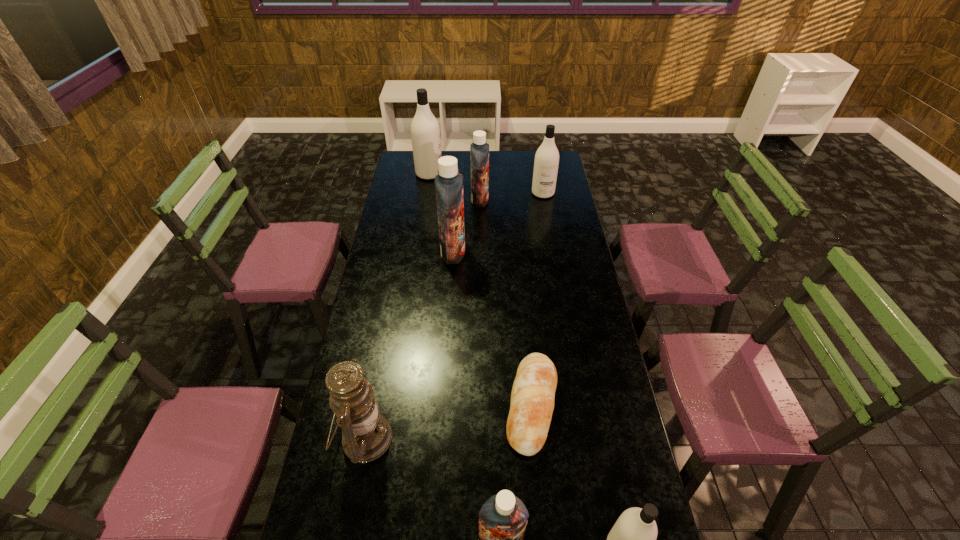
Select which shampoo appears as the second closest to the oil lamp. Please provide its 2D coordinates. Your answer should be formatted as a tuple, i.e. [(x, y)], where the tuple contains the x and y coordinates of a point satisfying the conditions above.

[(632, 539)]

The image size is (960, 540). Find the location of `the second closest white shampoo to the second nearest white shampoo`. the second closest white shampoo to the second nearest white shampoo is located at coordinates (632, 539).

Find the location of a particular element. the closest white shampoo to the nearest blue shampoo is located at coordinates (632, 539).

Identify which blue shampoo is the nearest to the farthest object. Please provide its 2D coordinates. Your answer should be formatted as a tuple, i.e. [(x, y)], where the tuple contains the x and y coordinates of a point satisfying the conditions above.

[(479, 150)]

I want to click on the second closest blue shampoo relative to the smallest blue shampoo, so point(479,150).

Where is `vacant space that satisfies the following two spatial constraints: 1. on the front label of the shortest object; 2. on the left side of the farthest blue shampoo`? vacant space that satisfies the following two spatial constraints: 1. on the front label of the shortest object; 2. on the left side of the farthest blue shampoo is located at coordinates pos(480,406).

The image size is (960, 540). In order to click on free point that satisfies the following two spatial constraints: 1. on the front-facing side of the second farthest white shampoo; 2. on the front label of the fifth nearest object in this screenshot , I will do `click(553, 252)`.

You are a GUI agent. You are given a task and a screenshot of the screen. Output one action in this format:
    pyautogui.click(x=<x>, y=<y>)
    Task: Click on the vacant space that satisfies the following two spatial constraints: 1. on the front label of the farthest blue shampoo; 2. on the front side of the oil lamp
    
    Given the screenshot: What is the action you would take?
    pyautogui.click(x=480, y=438)

The height and width of the screenshot is (540, 960). I want to click on free spot that satisfies the following two spatial constraints: 1. on the back side of the shortest object; 2. on the front-facing side of the leftmost shampoo, so click(x=511, y=174).